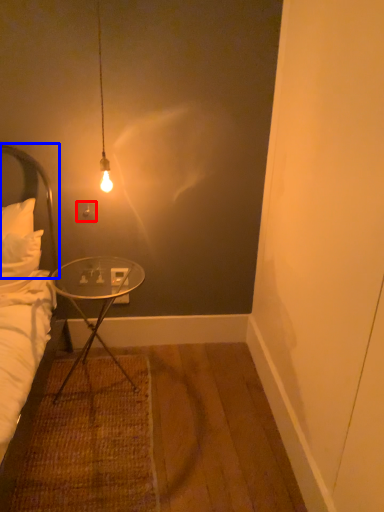
Question: Which of the following is the farthest to the observer, power outlet (highlighted by a red box) or headboard (highlighted by a blue box)?

Choices:
 (A) power outlet
 (B) headboard

Answer: (A)